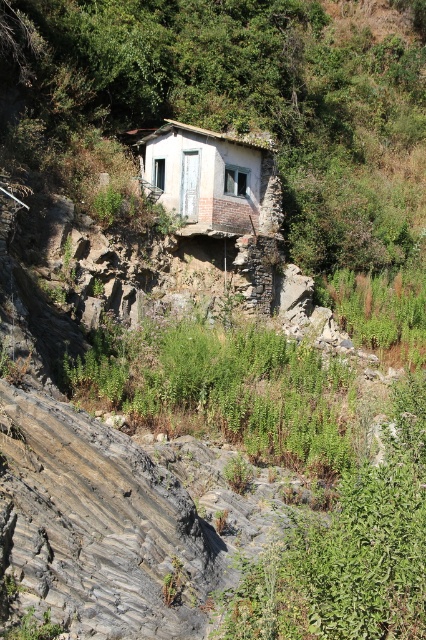
You are a delivery drone carrying a package that requires a landing zone of at least 8 meters in diameter. You need to land near the green leafy plants at center and the white weathered hut at center. Is there enough space between them to safely land?

The distance between the green leafy plants at center and the white weathered hut at center is 7.46 meters, which is less than the required 8 meters. Therefore, there is not enough space to safely land between them.

You are a hiker who wants to take a photo of the white weathered hut at center without any obstruction. Based on the scene, will the green leafy plants at center block your view of the hut?

The green leafy plants at center has a lesser height compared to white weathered hut at center, so the plants are shorter than the hut and won